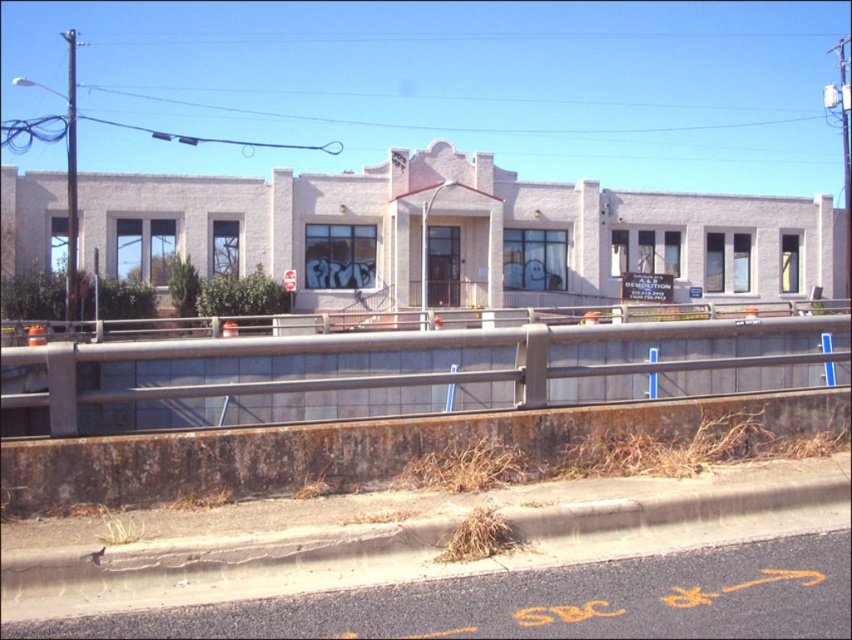
Based on the photo, you are a photographer standing at the entrance of the two story building with a light colored facade. You want to take a photo of the rusty metal rail at center while keeping the camera at a safe distance. What is the minimum distance you need to maintain between yourself and the camera to avoid being in the shot?

The minimum distance you need to maintain between yourself and the camera is 5.97 meters, as the rusty metal rail at center and camera are 5.97 meters apart from each other.

You are a city planner reviewing a site for potential repairs. You notice a point marked at coordinates (412, 371) on the image. Based on the scene description, what does this point indicate?

The point at coordinates (412, 371) marks the location of a rusty metal rail at the center of the image.